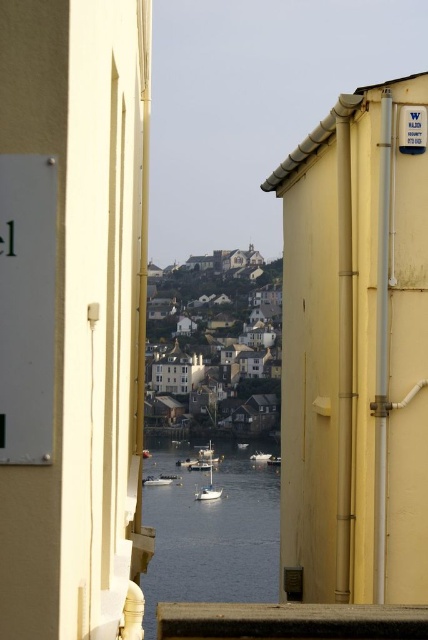
Which is more to the right, smooth water at center or white matte boat at center?

From the viewer's perspective, white matte boat at center appears more on the right side.

Where is `smooth water at center`? smooth water at center is located at coordinates (211, 532).

At what (x,y) coordinates should I click in order to perform the action: click on smooth water at center. Please return your answer as a coordinate pair (x, y). Image resolution: width=428 pixels, height=640 pixels. Looking at the image, I should click on (211, 532).

Between white glossy sailboat at center and white glossy boat at center, which one is positioned lower?

white glossy boat at center is below.

Who is higher up, white glossy sailboat at center or white glossy boat at center?

white glossy sailboat at center

What do you see at coordinates (208, 490) in the screenshot?
I see `white glossy sailboat at center` at bounding box center [208, 490].

Image resolution: width=428 pixels, height=640 pixels. I want to click on white glossy sailboat at center, so click(x=208, y=490).

Between smooth water at center and white glossy boat at center, which one has less height?

white glossy boat at center

Can you confirm if smooth water at center is shorter than white glossy boat at center?

No, smooth water at center is not shorter than white glossy boat at center.

Locate an element on the screen. The image size is (428, 640). smooth water at center is located at coordinates (211, 532).